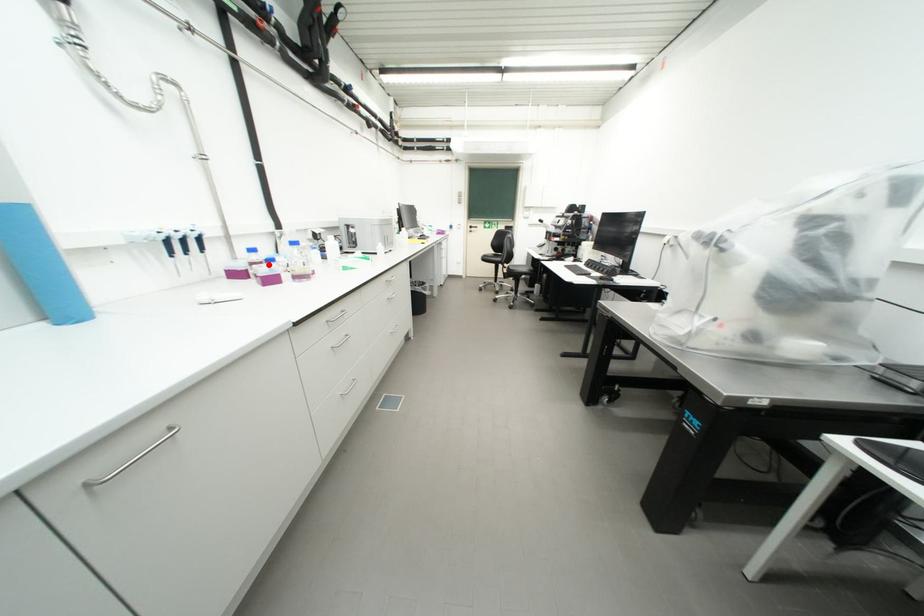
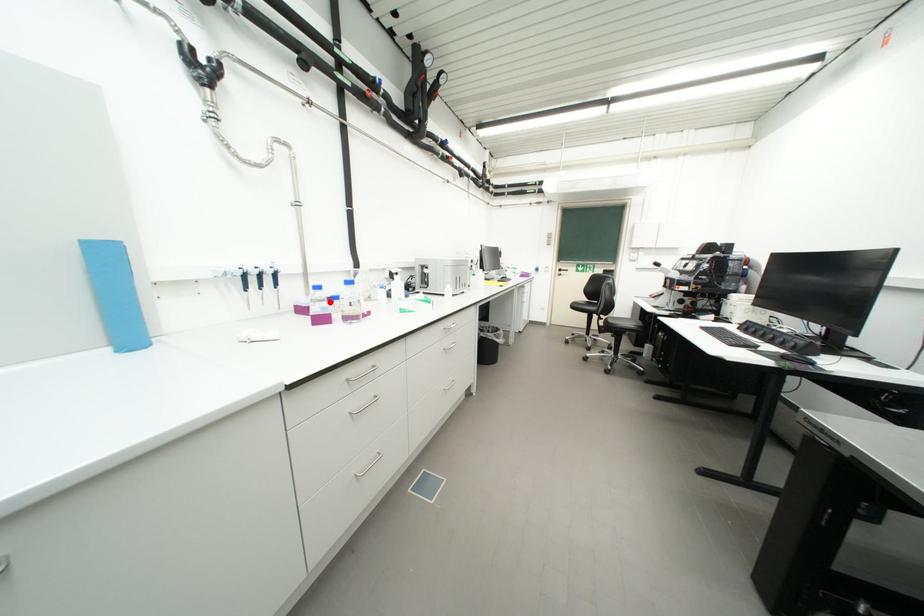
I am providing you with two images of the same scene from different viewpoints. A red point is marked on the first image and another point is marked on the second image. Is the red point in image1 aligned with the point shown in image2?

Yes